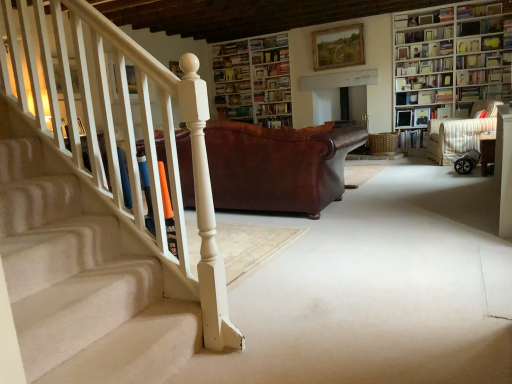
The image size is (512, 384). Describe the element at coordinates (471, 93) in the screenshot. I see `hardcover book at upper right, which is the 9th book from top to bottom` at that location.

What is the approximate height of hardcover book at upper right, the 3th book ordered from the bottom?

8.75 inches.

Describe the element at coordinates (424, 66) in the screenshot. I see `hardcover book at upper right, acting as the 8th book starting from the bottom` at that location.

Image resolution: width=512 pixels, height=384 pixels. Describe the element at coordinates (275, 122) in the screenshot. I see `hardcover book at center, the tenth book positioned from the top` at that location.

Describe the element at coordinates (253, 81) in the screenshot. I see `white wooden bookcase at upper center, which is the 1th bookcase in back-to-front order` at that location.

The height and width of the screenshot is (384, 512). What do you see at coordinates (420, 116) in the screenshot?
I see `wooden bookshelf at upper right, which is the first shelf from left to right` at bounding box center [420, 116].

At what (x,y) coordinates should I click in order to perform the action: click on hardcover book at upper right, which is the 9th book from top to bottom. Please return your answer as a coordinate pair (x, y). Looking at the image, I should click on (471, 93).

From a real-world perspective, does hardcover book at center, the tenth book positioned from the top, stand above hardcover book at upper right, the 3th book ordered from the bottom?

No, from a real-world perspective, hardcover book at center, the tenth book positioned from the top, is not over hardcover book at upper right, the 3th book ordered from the bottom

Looking at this image, considering the relative positions of hardcover book at center, which is the second book in bottom-to-top order, and hardcover book at upper right, which is the 9th book from top to bottom, in the image provided, is hardcover book at center, which is the second book in bottom-to-top order, behind hardcover book at upper right, which is the 9th book from top to bottom,?

Yes, the depth of hardcover book at center, which is the second book in bottom-to-top order, is greater than that of hardcover book at upper right, which is the 9th book from top to bottom.

Locate an element on the screen. The width and height of the screenshot is (512, 384). the 1st book above when counting from the hardcover book at center, the tenth book positioned from the top (from the image's perspective) is located at coordinates (471, 93).

From the image's perspective, between hardcover book at center, the tenth book positioned from the top, and hardcover book at upper right, the 3th book ordered from the bottom, who is located below?

hardcover book at center, the tenth book positioned from the top, appears lower in the image.

Does hardcover book at upper right, the 6th book in the bottom-to-top sequence, turn towards wooden picture frame at upper center?

No, hardcover book at upper right, the 6th book in the bottom-to-top sequence, is not facing towards wooden picture frame at upper center.

Would you say hardcover book at upper right, the 6th book in the bottom-to-top sequence, is to the left or to the right of wooden picture frame at upper center in the picture?

From the image, it's evident that hardcover book at upper right, the 6th book in the bottom-to-top sequence, is to the right of wooden picture frame at upper center.

Is hardcover book at upper right, the 6th book in the top-to-bottom sequence, shorter than wooden picture frame at upper center?

Indeed, hardcover book at upper right, the 6th book in the top-to-bottom sequence, has a lesser height compared to wooden picture frame at upper center.

From the image's perspective, does wooden bookshelf at upper right, the 1th shelf when ordered from right to left, appear higher than hardcover book at upper right, placed as the third book when sorted from top to bottom?

No, from the image's perspective, wooden bookshelf at upper right, the 1th shelf when ordered from right to left, is not on top of hardcover book at upper right, placed as the third book when sorted from top to bottom.

Is wooden bookshelf at upper right, the second shelf positioned from the bottom, further to the viewer compared to hardcover book at upper right, placed as the third book when sorted from top to bottom?

Yes, it is behind hardcover book at upper right, placed as the third book when sorted from top to bottom.

Which is in front, point (494, 53) or point (511, 15)?

The point (511, 15) is closer.

Is wooden bookshelf at upper right, which is the 1th shelf in front-to-back order, situated inside hardcover book at upper right, placed as the third book when sorted from top to bottom, or outside?

wooden bookshelf at upper right, which is the 1th shelf in front-to-back order, cannot be found inside hardcover book at upper right, placed as the third book when sorted from top to bottom.

Looking at this image, is hardcover book at upper right, placed as the 1th book when sorted from bottom to top, to the left of hardcover book at upper right, positioned as the 4th book in top-to-bottom order, from the viewer's perspective?

Yes.

From a real-world perspective, relative to hardcover book at upper right, positioned as the 4th book in top-to-bottom order, is hardcover book at upper right, placed as the 1th book when sorted from bottom to top, vertically above or below?

Clearly, from a real-world perspective, hardcover book at upper right, placed as the 1th book when sorted from bottom to top, is below hardcover book at upper right, positioned as the 4th book in top-to-bottom order.

Which is nearer, (400, 148) or (417, 67)?

The point (417, 67) is closer.

Are hardcover book at upper center, marked as the eleventh book in a bottom-to-top arrangement, and hardcover book at center, marked as the seventh book in a top-to-bottom arrangement, far apart?

hardcover book at upper center, marked as the eleventh book in a bottom-to-top arrangement, is near hardcover book at center, marked as the seventh book in a top-to-bottom arrangement, not far away.

In terms of width, does hardcover book at upper center, which is the 1th book from top to bottom, look wider or thinner when compared to hardcover book at center, marked as the seventh book in a top-to-bottom arrangement?

In the image, hardcover book at upper center, which is the 1th book from top to bottom, appears to be wider than hardcover book at center, marked as the seventh book in a top-to-bottom arrangement.

Is hardcover book at upper center, which is the 1th book from top to bottom, taller or shorter than hardcover book at center, marked as the seventh book in a top-to-bottom arrangement?

In the image, hardcover book at upper center, which is the 1th book from top to bottom, appears to be taller than hardcover book at center, marked as the seventh book in a top-to-bottom arrangement.

From a real-world perspective, relative to hardcover book at center, marked as the seventh book in a top-to-bottom arrangement, is hardcover book at upper center, which is the 1th book from top to bottom, vertically above or below?

Clearly, from a real-world perspective, hardcover book at upper center, which is the 1th book from top to bottom, is above hardcover book at center, marked as the seventh book in a top-to-bottom arrangement.

From the image's perspective, relative to hardcover book at center, the 8th book positioned from the top, is hardcover book at upper right, the second book viewed from the top, above or below?

Based on their image positions, hardcover book at upper right, the second book viewed from the top, is located above hardcover book at center, the 8th book positioned from the top.

Looking at this image, between hardcover book at upper right, the 10th book when ordered from bottom to top, and hardcover book at center, the 8th book positioned from the top, which one appears on the right side from the viewer's perspective?

hardcover book at upper right, the 10th book when ordered from bottom to top, is more to the right.

Is hardcover book at upper right, the second book viewed from the top, surrounding hardcover book at center, which appears as the fourth book when ordered from the bottom?

Actually, hardcover book at center, which appears as the fourth book when ordered from the bottom, is outside hardcover book at upper right, the second book viewed from the top.

Is hardcover book at upper right, the 10th book when ordered from bottom to top, oriented away from hardcover book at center, the 8th book positioned from the top?

hardcover book at upper right, the 10th book when ordered from bottom to top, does not have its back to hardcover book at center, the 8th book positioned from the top.

Does hardcover book at upper right, the 6th book in the bottom-to-top sequence, have a smaller size compared to hardcover book at upper right, the 10th book when ordered from bottom to top?

Correct, hardcover book at upper right, the 6th book in the bottom-to-top sequence, occupies less space than hardcover book at upper right, the 10th book when ordered from bottom to top.

From a real-world perspective, is hardcover book at upper right, the 6th book in the top-to-bottom sequence, positioned above or below hardcover book at upper right, the second book viewed from the top?

From a real-world perspective, hardcover book at upper right, the 6th book in the top-to-bottom sequence, is physically below hardcover book at upper right, the second book viewed from the top.

Does point (463, 74) come behind point (448, 29)?

Yes, it is behind point (448, 29).

Where is `book that is the 1st object located below the hardcover book at upper right, the 3th book ordered from the bottom (from the image's perspective)`? book that is the 1st object located below the hardcover book at upper right, the 3th book ordered from the bottom (from the image's perspective) is located at coordinates (275, 122).

Find the location of a particular element. The height and width of the screenshot is (384, 512). book that is the 3rd one below the wooden picture frame at upper center (from a real-world perspective) is located at coordinates (483, 77).

From the picture: Which object lies further to the anchor point wooden bookshelf at upper right, positioned as the second shelf in back-to-front order, hardcover book at upper right, acting as the 9th book starting from the bottom, or hardcover book at upper right, arranged as the fifth book when viewed from the top?

Among the two, hardcover book at upper right, arranged as the fifth book when viewed from the top, is located further to wooden bookshelf at upper right, positioned as the second shelf in back-to-front order.

Considering their positions, is hardcover book at upper right, the second book viewed from the top, positioned further to hardcover book at center, the 8th book positioned from the top, than hardcover book at upper right, acting as the eleventh book starting from the top?

hardcover book at upper right, the second book viewed from the top.

From the image, which object appears to be farther from hardcover book at upper right, placed as the third book when sorted from top to bottom, hardcover book at center, marked as the 5th book in a bottom-to-top arrangement, or hardcover book at center, the 8th book positioned from the top?

hardcover book at center, the 8th book positioned from the top.

From the image, which object appears to be farther from hardcover book at upper right, the 3th book ordered from the bottom, hardcover book at upper center, marked as the eleventh book in a bottom-to-top arrangement, or hardcover book at upper right, the seventh book ordered from the bottom?

hardcover book at upper center, marked as the eleventh book in a bottom-to-top arrangement, is positioned further to the anchor hardcover book at upper right, the 3th book ordered from the bottom.

Estimate the real-world distances between objects in this image. Which object is further from hardcover book at upper right, placed as the 1th book when sorted from bottom to top, wooden chair at right or hardcover book at upper right, acting as the 8th book starting from the bottom?

The object further to hardcover book at upper right, placed as the 1th book when sorted from bottom to top, is wooden chair at right.

Considering their positions, is hardcover book at upper right, which is the 9th book from top to bottom, positioned closer to wooden chair at right than hardcover book at upper right, acting as the 9th book starting from the bottom?

The object closer to wooden chair at right is hardcover book at upper right, which is the 9th book from top to bottom.

Considering their positions, is hardcover book at upper center, marked as the eleventh book in a bottom-to-top arrangement, positioned closer to wooden bookcase at upper right, the 2th bookcase viewed from the left, than brown leather couch at center?

hardcover book at upper center, marked as the eleventh book in a bottom-to-top arrangement, is positioned closer to the anchor wooden bookcase at upper right, the 2th bookcase viewed from the left.

Estimate the real-world distances between objects in this image. Which object is closer to striped fabric armchair at right, hardcover book at center, which is the second book in bottom-to-top order, or hardcover book at upper center, marked as the eleventh book in a bottom-to-top arrangement?

hardcover book at center, which is the second book in bottom-to-top order.

Identify the location of bookcase located between hardcover book at center, the 8th book positioned from the top, and wooden bookcase at upper right, which is the first bookcase from right to left, in the left-right direction. This screenshot has width=512, height=384. (253, 81).

What are the coordinates of `armchair between hardcover book at upper right, the 10th book when ordered from bottom to top, and wooden chair at right, in the vertical direction` in the screenshot? It's located at (460, 133).

At what (x,y) coordinates should I click in order to perform the action: click on shelf between hardcover book at center, which appears as the fourth book when ordered from the bottom, and hardcover book at upper right, placed as the third book when sorted from top to bottom, in the horizontal direction. Please return your answer as a coordinate pair (x, y). This screenshot has width=512, height=384. Looking at the image, I should click on (x=420, y=116).

Where is `armchair between brown leather couch at center and hardcover book at upper right, the 6th book in the bottom-to-top sequence, in the horizontal direction`? armchair between brown leather couch at center and hardcover book at upper right, the 6th book in the bottom-to-top sequence, in the horizontal direction is located at coordinates (460, 133).